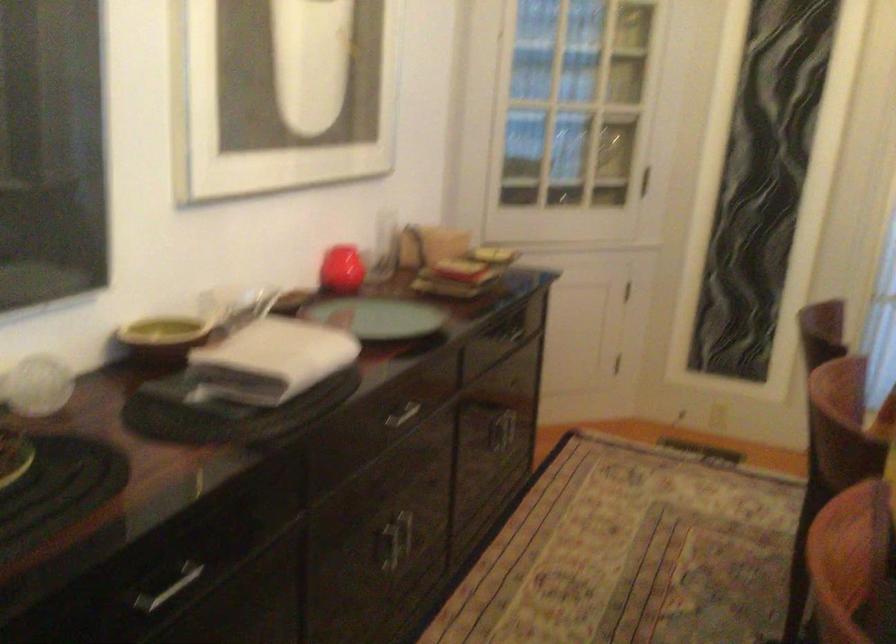
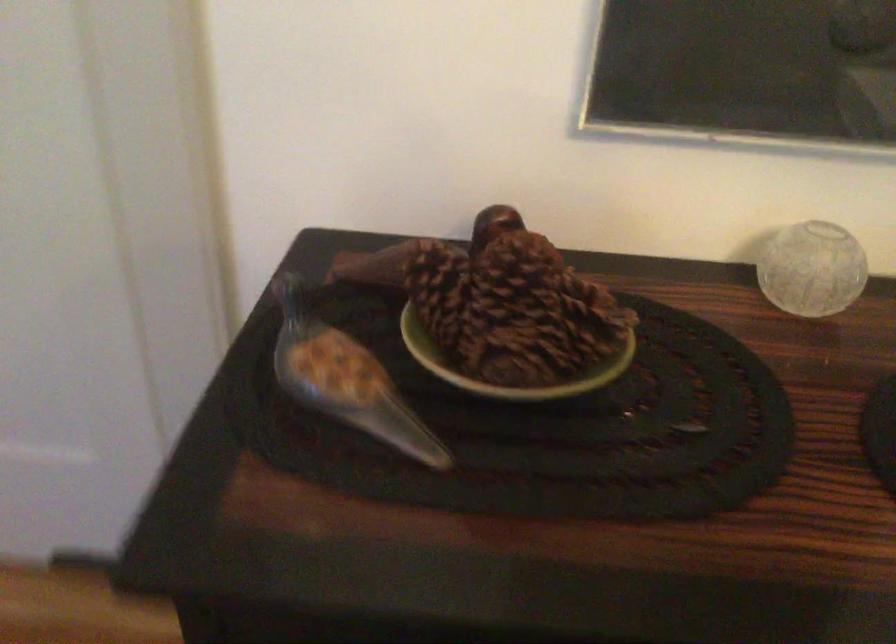
The images are taken continuously from a first-person perspective. In which direction is your viewpoint rotating?

The camera's rotation is toward left-down.